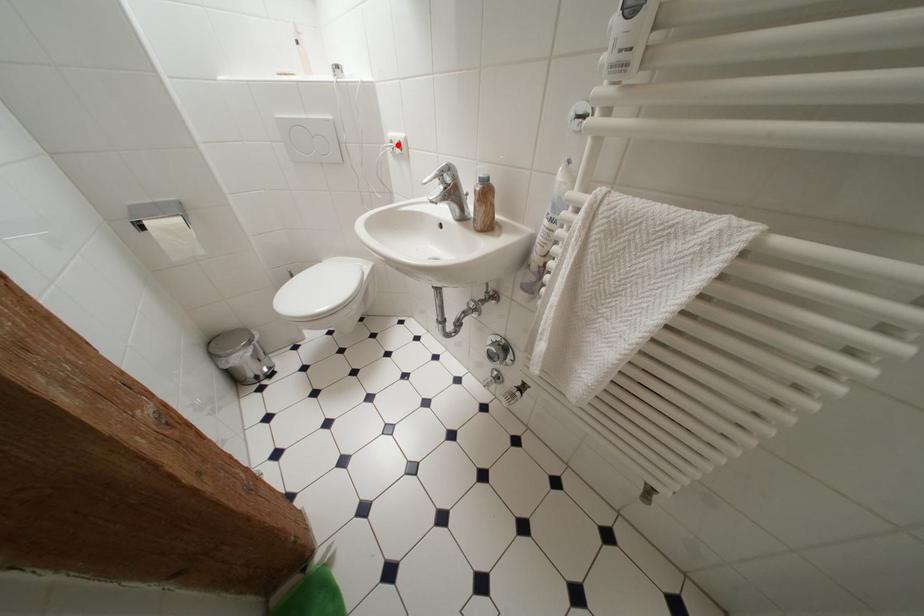
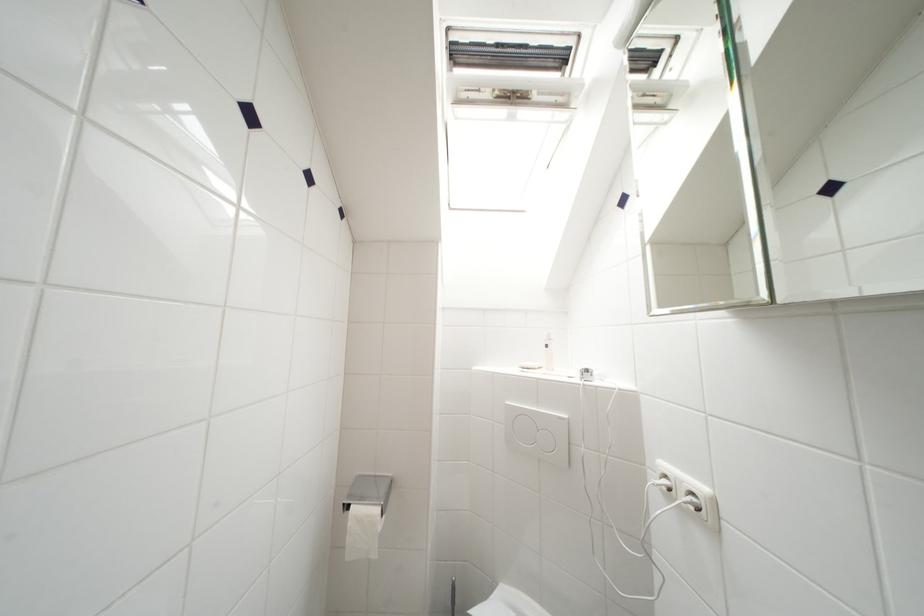
Where in the second image is the point corresponding to the highlighted location from the first image?

(672, 480)